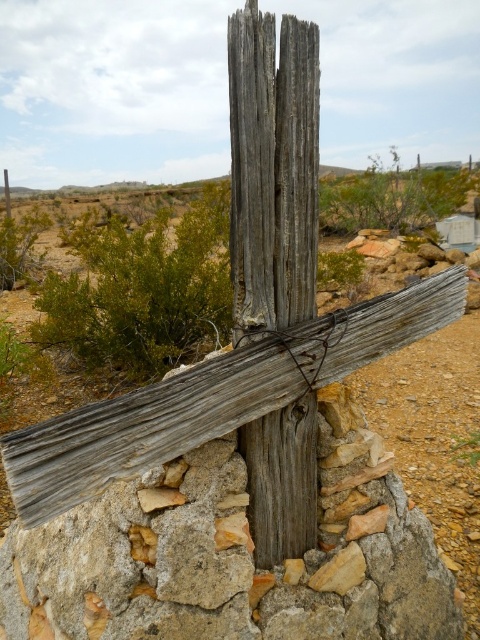
Question: Is weathered wood cross at center further to the viewer compared to weathered wood pole at center?

Choices:
 (A) yes
 (B) no

Answer: (B)

Question: Which point is farther from the camera taking this photo?

Choices:
 (A) (260, 452)
 (B) (432, 625)

Answer: (B)

Question: Which of the following is the farthest from the observer?

Choices:
 (A) (325, 573)
 (B) (296, 413)

Answer: (A)

Question: Does weathered wood cross at center appear on the right side of weathered wood pole at center?

Choices:
 (A) no
 (B) yes

Answer: (B)

Question: Is weathered wood cross at center further to the viewer compared to weathered wood pole at center?

Choices:
 (A) no
 (B) yes

Answer: (A)